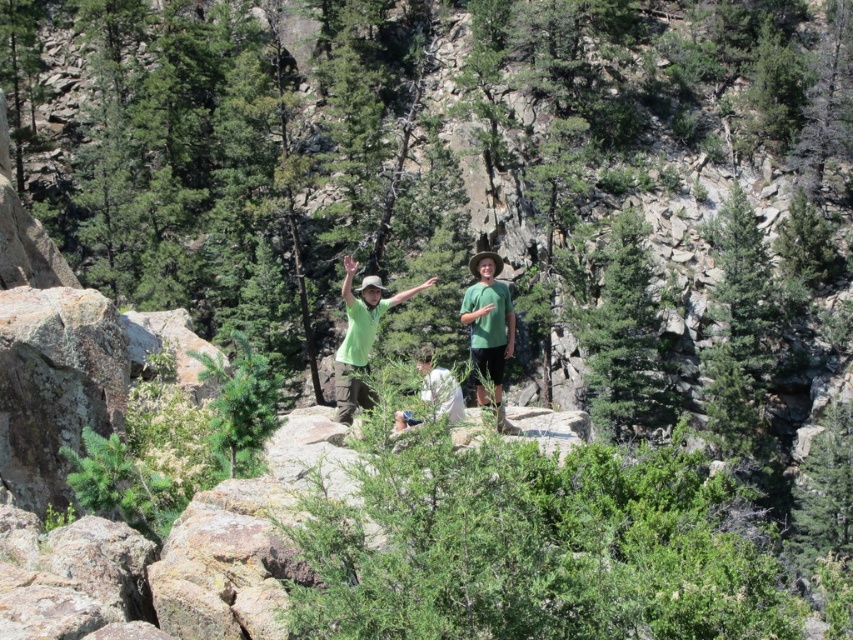
You are standing in the forest scene described. You see both the green matte shirt at center and the white cotton shirt at center. Which one is positioned more to the left?

The green matte shirt at center is positioned to the left of the white cotton shirt at center, so the green matte shirt at center is more to the left.

You are standing at the same spot as the viewer. There is a green matte shirt at center. Can you reach it without moving your feet?

The green matte shirt at center is 12.58 meters away from the viewer, so you cannot reach it without moving your feet.

You are a photographer standing behind the two people in the scene. You want to take a photo that includes both the green matte shirt at center and the white cotton shirt at center. Which shirt should you position closer to the camera to ensure both are fully visible in the frame?

You should position the green matte shirt at center closer to the camera because the white cotton shirt at center is behind it, ensuring both are visible without obstruction.